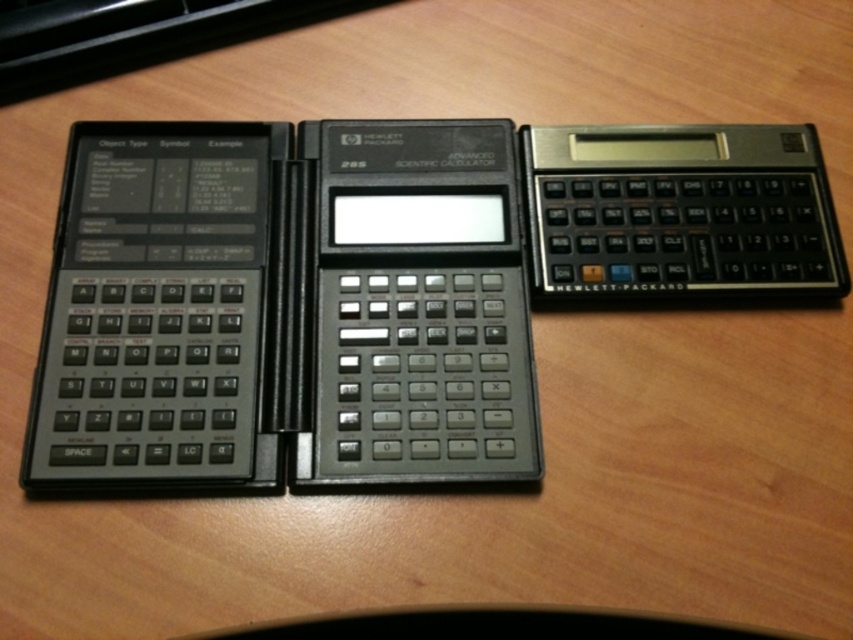
Question: Is black matte scientific calculator at left closer to camera compared to black plastic keyboard at left?

Choices:
 (A) yes
 (B) no

Answer: (A)

Question: Which point is closer to the camera taking this photo?

Choices:
 (A) [x=74, y=29]
 (B) [x=625, y=616]
 (C) [x=62, y=282]
 (D) [x=706, y=221]

Answer: (B)

Question: Is black matte scientific calculator at left thinner than black plastic keyboard at lower center?

Choices:
 (A) yes
 (B) no

Answer: (A)

Question: Which point is farther from the camera taking this photo?

Choices:
 (A) (537, 609)
 (B) (325, 282)
 (C) (679, 138)
 (D) (201, 49)

Answer: (D)

Question: Which point is closer to the camera taking this photo?

Choices:
 (A) pos(36,29)
 (B) pos(335,618)

Answer: (B)

Question: Is black matte scientific calculator at left above black plastic keyboard at left?

Choices:
 (A) yes
 (B) no

Answer: (B)